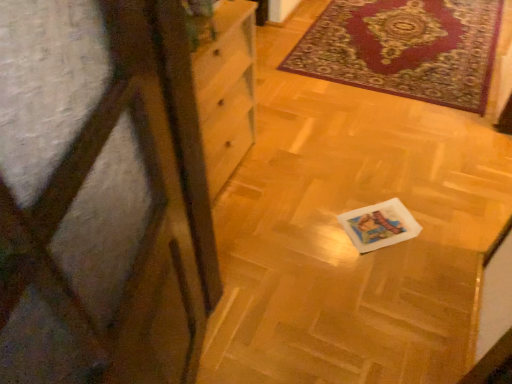
Describe the element at coordinates (405, 49) in the screenshot. This screenshot has height=384, width=512. I see `velvet-like red rug at upper right` at that location.

Where is `velvet-like red rug at upper right`? This screenshot has height=384, width=512. velvet-like red rug at upper right is located at coordinates (405, 49).

Identify the location of transparent plastic screen door at left. The image size is (512, 384). (101, 196).

What do you see at coordinates (101, 196) in the screenshot? The image size is (512, 384). I see `transparent plastic screen door at left` at bounding box center [101, 196].

Where is `velvet-like red rug at upper right`? velvet-like red rug at upper right is located at coordinates pyautogui.click(x=405, y=49).

Is velvet-like red rug at upper right to the left of transparent plastic screen door at left from the viewer's perspective?

Incorrect, velvet-like red rug at upper right is not on the left side of transparent plastic screen door at left.

Between velvet-like red rug at upper right and transparent plastic screen door at left, which one is positioned in front?

transparent plastic screen door at left is closer to the camera.

Considering the points (332, 37) and (81, 212), which point is in front, point (332, 37) or point (81, 212)?

The point (81, 212) is closer.

Consider the image. From the image's perspective, which one is positioned lower, velvet-like red rug at upper right or transparent plastic screen door at left?

From the image's view, transparent plastic screen door at left is below.

From a real-world perspective, is velvet-like red rug at upper right beneath transparent plastic screen door at left?

Yes, from a real-world perspective, velvet-like red rug at upper right is beneath transparent plastic screen door at left.

Considering the relative sizes of velvet-like red rug at upper right and transparent plastic screen door at left in the image provided, is velvet-like red rug at upper right thinner than transparent plastic screen door at left?

No, velvet-like red rug at upper right is not thinner than transparent plastic screen door at left.

Considering the relative sizes of velvet-like red rug at upper right and transparent plastic screen door at left in the image provided, is velvet-like red rug at upper right taller than transparent plastic screen door at left?

Incorrect, the height of velvet-like red rug at upper right is not larger of that of transparent plastic screen door at left.

Which of these two, velvet-like red rug at upper right or transparent plastic screen door at left, is smaller?

With smaller size is transparent plastic screen door at left.

Is velvet-like red rug at upper right surrounding transparent plastic screen door at left?

Actually, transparent plastic screen door at left is outside velvet-like red rug at upper right.

Is velvet-like red rug at upper right next to transparent plastic screen door at left?

No, velvet-like red rug at upper right is not with transparent plastic screen door at left.

Does velvet-like red rug at upper right turn towards transparent plastic screen door at left?

No, velvet-like red rug at upper right does not turn towards transparent plastic screen door at left.

Measure the distance from velvet-like red rug at upper right to transparent plastic screen door at left.

A distance of 2.15 meters exists between velvet-like red rug at upper right and transparent plastic screen door at left.

This screenshot has height=384, width=512. I want to click on screen door above the velvet-like red rug at upper right (from a real-world perspective), so click(101, 196).

Does transparent plastic screen door at left appear on the left side of velvet-like red rug at upper right?

Indeed, transparent plastic screen door at left is positioned on the left side of velvet-like red rug at upper right.

Relative to velvet-like red rug at upper right, is transparent plastic screen door at left in front or behind?

Visually, transparent plastic screen door at left is located in front of velvet-like red rug at upper right.

Considering the positions of points (188, 280) and (447, 13), is point (188, 280) farther from camera compared to point (447, 13)?

That is False.

From the image's perspective, is transparent plastic screen door at left under velvet-like red rug at upper right?

Yes, from the image's perspective, transparent plastic screen door at left is beneath velvet-like red rug at upper right.

From a real-world perspective, is transparent plastic screen door at left positioned over velvet-like red rug at upper right based on gravity?

Yes, from a real-world perspective, transparent plastic screen door at left is over velvet-like red rug at upper right

Which of these two, transparent plastic screen door at left or velvet-like red rug at upper right, is thinner?

With smaller width is transparent plastic screen door at left.

Which of these two, transparent plastic screen door at left or velvet-like red rug at upper right, stands taller?

transparent plastic screen door at left is taller.

Does transparent plastic screen door at left have a smaller size compared to velvet-like red rug at upper right?

Correct, transparent plastic screen door at left occupies less space than velvet-like red rug at upper right.

Is transparent plastic screen door at left surrounding velvet-like red rug at upper right?

No, velvet-like red rug at upper right is not surrounded by transparent plastic screen door at left.

Does transparent plastic screen door at left touch velvet-like red rug at upper right?

No, transparent plastic screen door at left is not beside velvet-like red rug at upper right.

Is transparent plastic screen door at left oriented towards velvet-like red rug at upper right?

No, transparent plastic screen door at left is not turned towards velvet-like red rug at upper right.

In the image, there is a transparent plastic screen door at left. Identify the location of mat above it (from the image's perspective). (405, 49).

This screenshot has height=384, width=512. What are the coordinates of `mat behind the transparent plastic screen door at left` in the screenshot? It's located at (405, 49).

The image size is (512, 384). What are the coordinates of `mat above the transparent plastic screen door at left (from the image's perspective)` in the screenshot? It's located at (405, 49).